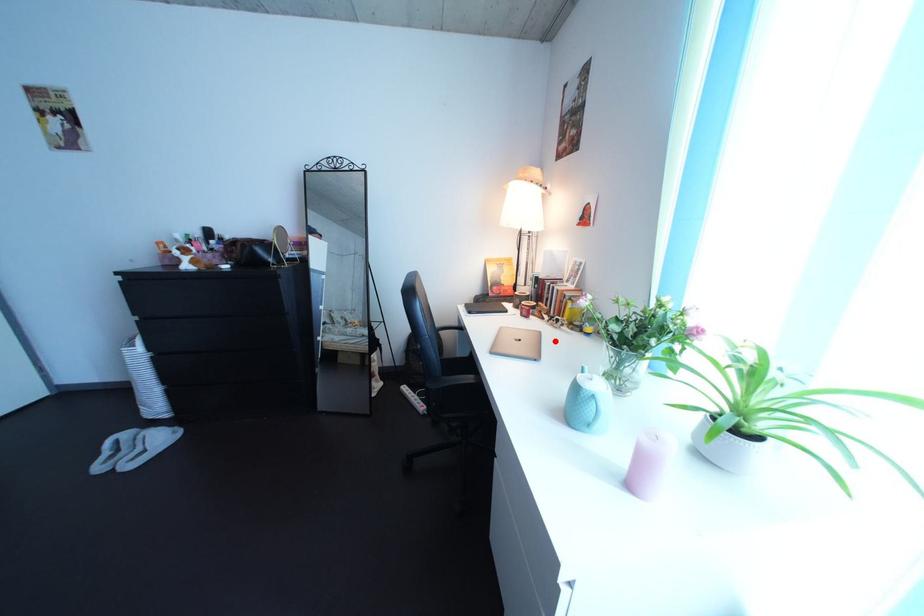
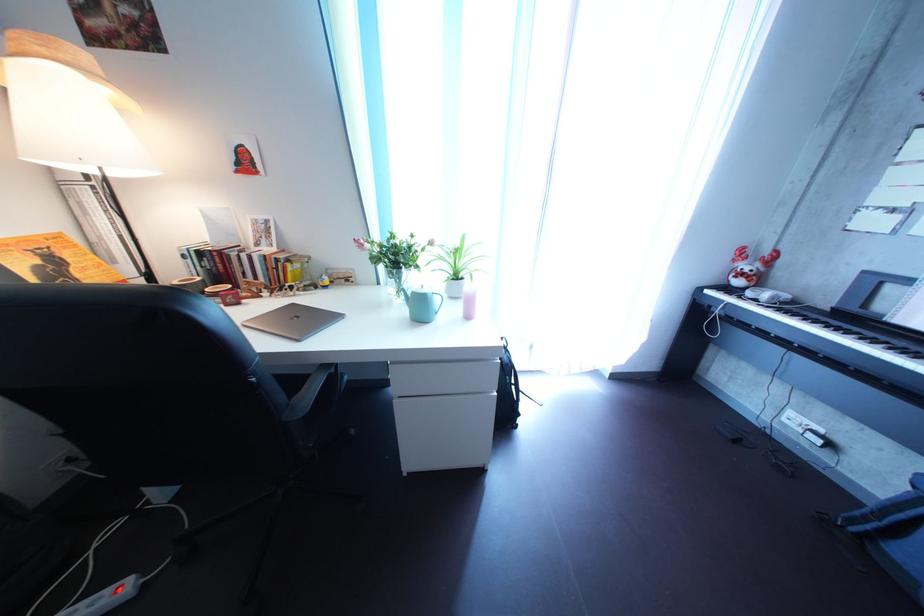
Find the pixel in the second image that matches the highlighted location in the first image.

(308, 313)